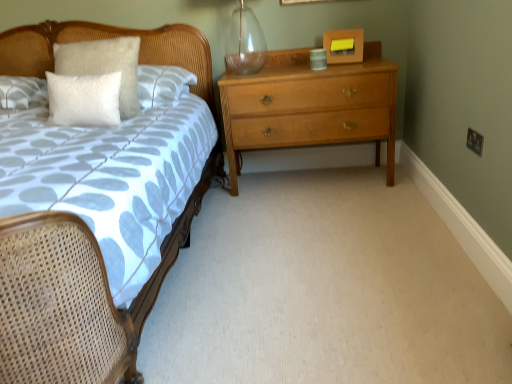
Question: Is light brown wood chest of drawers at center wider or thinner than transparent glass vase at upper center?

Choices:
 (A) wide
 (B) thin

Answer: (A)

Question: Considering the positions of point (284, 110) and point (240, 71), is point (284, 110) closer or farther from the camera than point (240, 71)?

Choices:
 (A) closer
 (B) farther

Answer: (A)

Question: Considering the real-world distances, which object is closest to the transparent glass vase at upper center?

Choices:
 (A) white fluffy pillow at upper left
 (B) light brown wood chest of drawers at center
 (C) wooden bed at left
 (D) white textured pillow at upper left

Answer: (C)

Question: Which object is the closest to the transparent glass vase at upper center?

Choices:
 (A) white textured pillow at upper left
 (B) light brown wood chest of drawers at center
 (C) wooden bed at left
 (D) white fluffy pillow at upper left

Answer: (C)